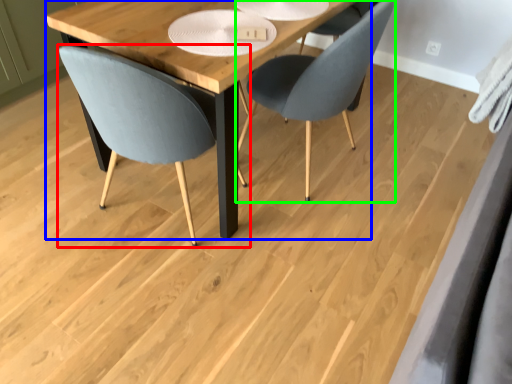
Question: Based on their relative distances, which object is farther from chair (highlighted by a red box)? Choose from table (highlighted by a blue box) and chair (highlighted by a green box).

Choices:
 (A) table
 (B) chair

Answer: (B)